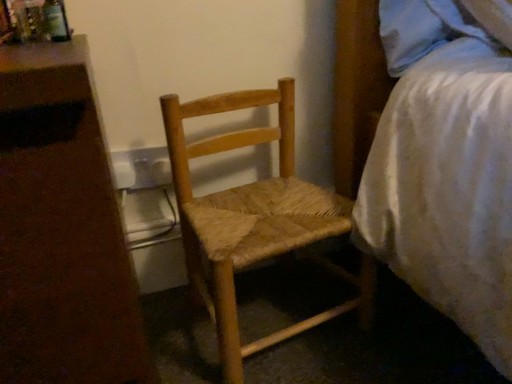
Question: Is white plastic nightstand at left not near natural wood woven chair at center?

Choices:
 (A) yes
 (B) no

Answer: (B)

Question: Can you confirm if white plastic nightstand at left is wider than natural wood woven chair at center?

Choices:
 (A) no
 (B) yes

Answer: (B)

Question: Can you confirm if white plastic nightstand at left is smaller than natural wood woven chair at center?

Choices:
 (A) no
 (B) yes

Answer: (A)

Question: Does white plastic nightstand at left have a greater height compared to natural wood woven chair at center?

Choices:
 (A) no
 (B) yes

Answer: (B)

Question: Can you confirm if white plastic nightstand at left is positioned to the left of natural wood woven chair at center?

Choices:
 (A) yes
 (B) no

Answer: (A)

Question: Looking at the image, does natural wood woven chair at center seem bigger or smaller compared to white plastic nightstand at left?

Choices:
 (A) small
 (B) big

Answer: (A)

Question: Is point click(220, 198) closer or farther from the camera than point click(59, 104)?

Choices:
 (A) closer
 (B) farther

Answer: (B)

Question: From a real-world perspective, is natural wood woven chair at center above or below white plastic nightstand at left?

Choices:
 (A) above
 (B) below

Answer: (B)

Question: Do you think natural wood woven chair at center is within white plastic nightstand at left, or outside of it?

Choices:
 (A) inside
 (B) outside

Answer: (B)

Question: Is white plastic nightstand at left inside or outside of white textured bed at right?

Choices:
 (A) inside
 (B) outside

Answer: (B)

Question: Is white plastic nightstand at left in front of or behind white textured bed at right in the image?

Choices:
 (A) front
 (B) behind

Answer: (A)

Question: From a real-world perspective, is white plastic nightstand at left positioned above or below white textured bed at right?

Choices:
 (A) above
 (B) below

Answer: (B)

Question: Is white plastic nightstand at left to the left or to the right of white textured bed at right in the image?

Choices:
 (A) left
 (B) right

Answer: (A)

Question: Considering the positions of white plastic nightstand at left and natural wood woven chair at center in the image, is white plastic nightstand at left wider or thinner than natural wood woven chair at center?

Choices:
 (A) wide
 (B) thin

Answer: (A)

Question: From the image's perspective, is white plastic nightstand at left above or below natural wood woven chair at center?

Choices:
 (A) below
 (B) above

Answer: (A)